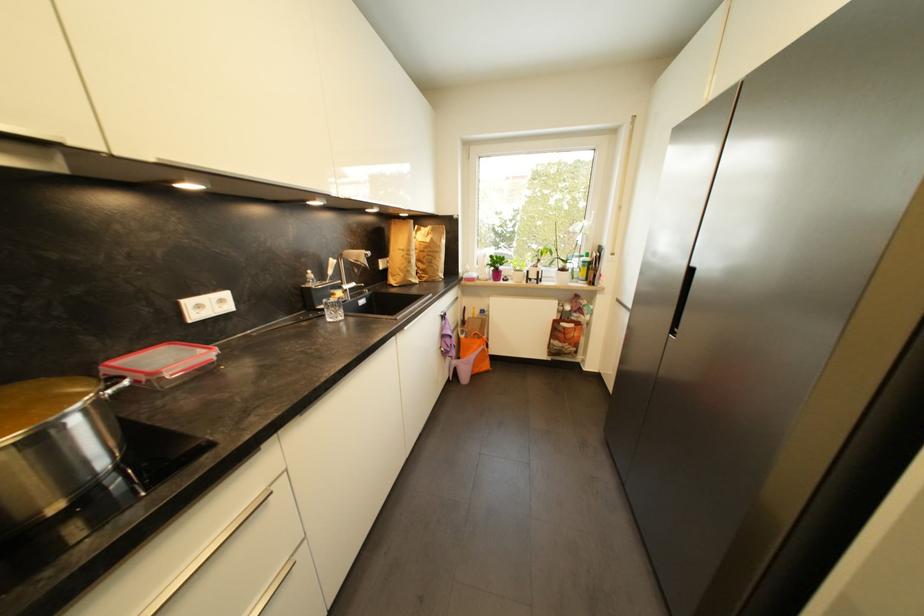
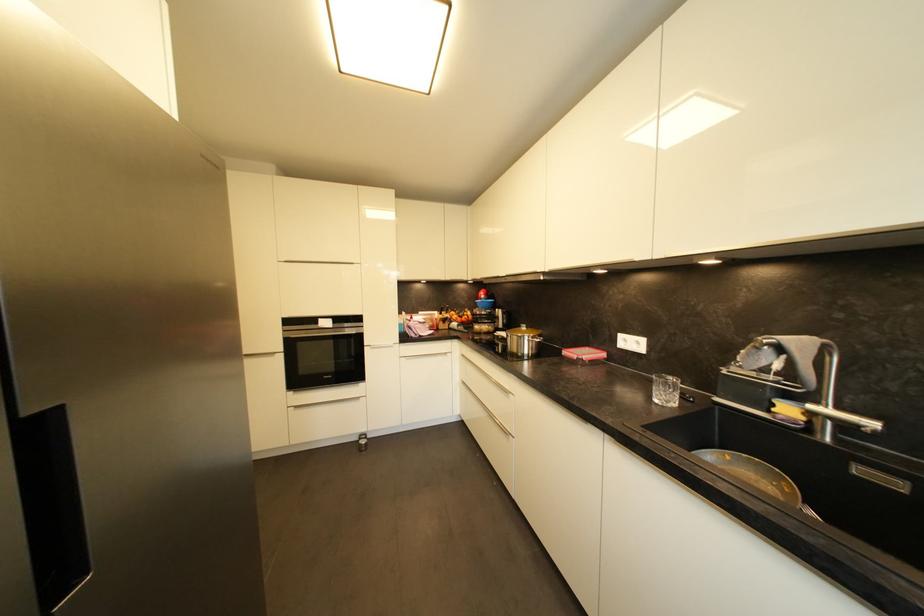
Locate, in the second image, the point that corresponds to (344,296) in the first image.

(793, 411)